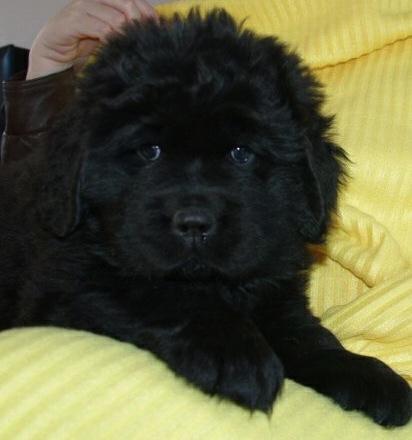
The image size is (412, 440). What are the coordinates of `blanket` in the screenshot? It's located at (105, 381).